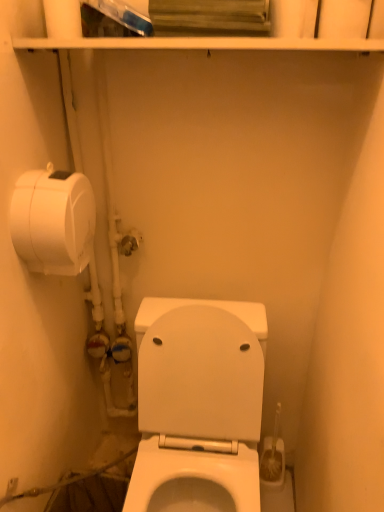
Question: Does point (251, 468) appear closer or farther from the camera than point (74, 252)?

Choices:
 (A) farther
 (B) closer

Answer: (A)

Question: From their relative heights in the image, would you say white glossy toilet at center is taller or shorter than white matte toilet paper at left?

Choices:
 (A) short
 (B) tall

Answer: (B)

Question: Considering the positions of white glossy toilet at center and white matte toilet paper at left in the image, is white glossy toilet at center bigger or smaller than white matte toilet paper at left?

Choices:
 (A) big
 (B) small

Answer: (A)

Question: From the image's perspective, is white matte toilet paper at left above or below white glossy toilet at center?

Choices:
 (A) below
 (B) above

Answer: (B)

Question: Visually, is white matte toilet paper at left positioned to the left or to the right of white glossy toilet at center?

Choices:
 (A) left
 (B) right

Answer: (A)

Question: In terms of size, does white matte toilet paper at left appear bigger or smaller than white glossy toilet at center?

Choices:
 (A) big
 (B) small

Answer: (B)

Question: Choose the correct answer: Is white matte toilet paper at left inside white glossy toilet at center or outside it?

Choices:
 (A) outside
 (B) inside

Answer: (A)